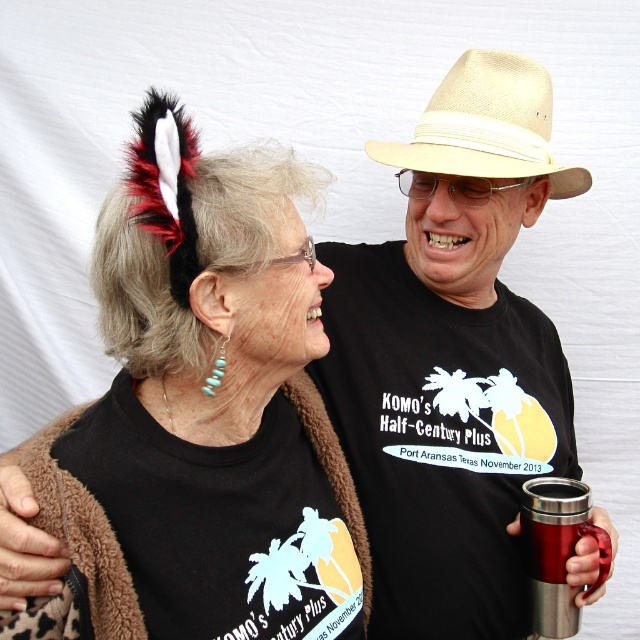
Is point (461, 113) behind point (532, 550)?

No, it is in front of (532, 550).

Can you confirm if beige straw hat at upper center is smaller than stainless steel cup at right?

No, beige straw hat at upper center is not smaller than stainless steel cup at right.

Which is behind, point (528, 138) or point (564, 600)?

Point (528, 138)

This screenshot has height=640, width=640. In order to click on beige straw hat at upper center in this screenshot , I will do `click(486, 125)`.

Find the location of a particular element. The height and width of the screenshot is (640, 640). black feather headband at upper left is located at coordinates (202, 416).

You are a GUI agent. You are given a task and a screenshot of the screen. Output one action in this format:
    pyautogui.click(x=<x>, y=<y>)
    Task: Click on the black feather headband at upper left
    
    Given the screenshot: What is the action you would take?
    pyautogui.click(x=202, y=416)

What are the coordinates of `black feather headband at upper left` in the screenshot? It's located at (202, 416).

Between black feather headband at upper left and beige straw hat at upper center, which one has less height?

beige straw hat at upper center is shorter.

Does black feather headband at upper left appear on the right side of beige straw hat at upper center?

No, black feather headband at upper left is not to the right of beige straw hat at upper center.

Which is in front, point (124, 589) or point (456, 115)?

Point (124, 589) is in front.

Where is `black feather headband at upper left`? Image resolution: width=640 pixels, height=640 pixels. black feather headband at upper left is located at coordinates (202, 416).